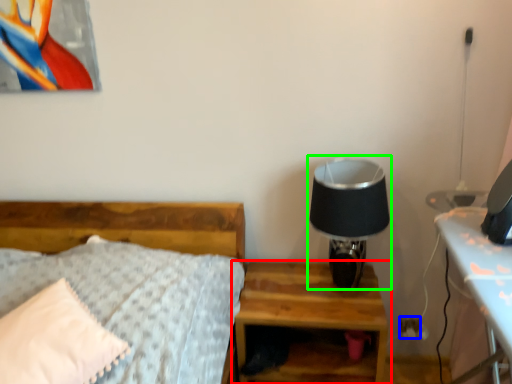
Question: Which object is the closest to the nightstand (highlighted by a red box)? Choose among these: electric outlet (highlighted by a blue box) or table lamp (highlighted by a green box).

Choices:
 (A) electric outlet
 (B) table lamp

Answer: (B)